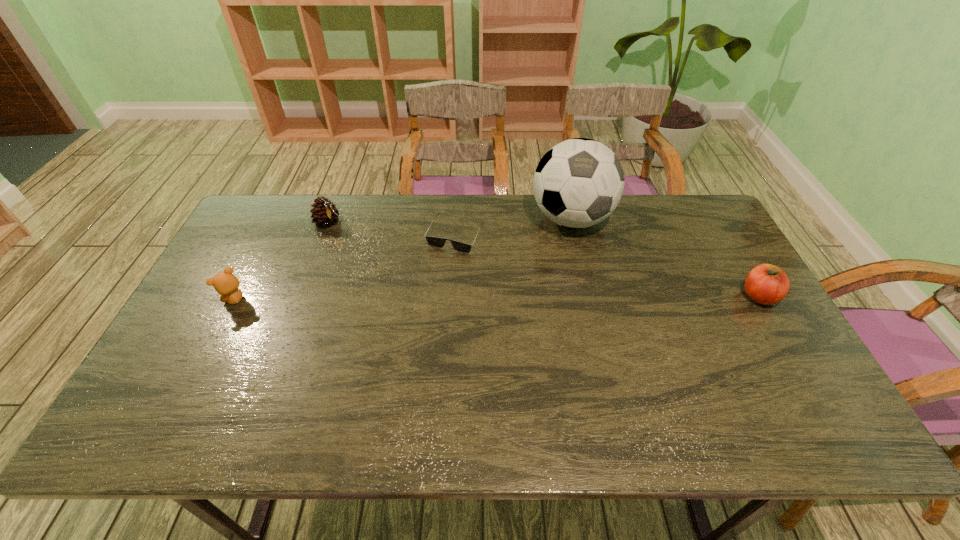
At what (x,y) coordinates should I click in order to perform the action: click on object at the left edge. Please return your answer as a coordinate pair (x, y). Looking at the image, I should click on (225, 283).

Find the location of a particular element. Image resolution: width=960 pixels, height=540 pixels. object that is at the right edge is located at coordinates (767, 284).

Find the location of a particular element. vacant space at the far edge of the desktop is located at coordinates point(345,227).

Find the location of a particular element. free space at the near edge of the desktop is located at coordinates (x=712, y=380).

Locate an element on the screen. vacant space at the left edge of the desktop is located at coordinates (244, 253).

In the image, there is a desktop. Find the location of `vacant area at the right edge`. vacant area at the right edge is located at coordinates (700, 293).

You are a GUI agent. You are given a task and a screenshot of the screen. Output one action in this format:
    pyautogui.click(x=<x>, y=<y>)
    Task: Click on the vacant position at the far left corner of the desktop
    The image size is (960, 540).
    Given the screenshot: What is the action you would take?
    pyautogui.click(x=285, y=204)

In the image, there is a desktop. At what (x,y) coordinates should I click in order to perform the action: click on free space at the far right corner. Please return your answer as a coordinate pair (x, y). This screenshot has width=960, height=540. Looking at the image, I should click on (698, 217).

Locate an element on the screen. This screenshot has width=960, height=540. unoccupied area between the soccer ball and the teddy bear is located at coordinates (403, 259).

Where is `free space between the teddy bear and the second object from left to right`? This screenshot has height=540, width=960. free space between the teddy bear and the second object from left to right is located at coordinates (282, 261).